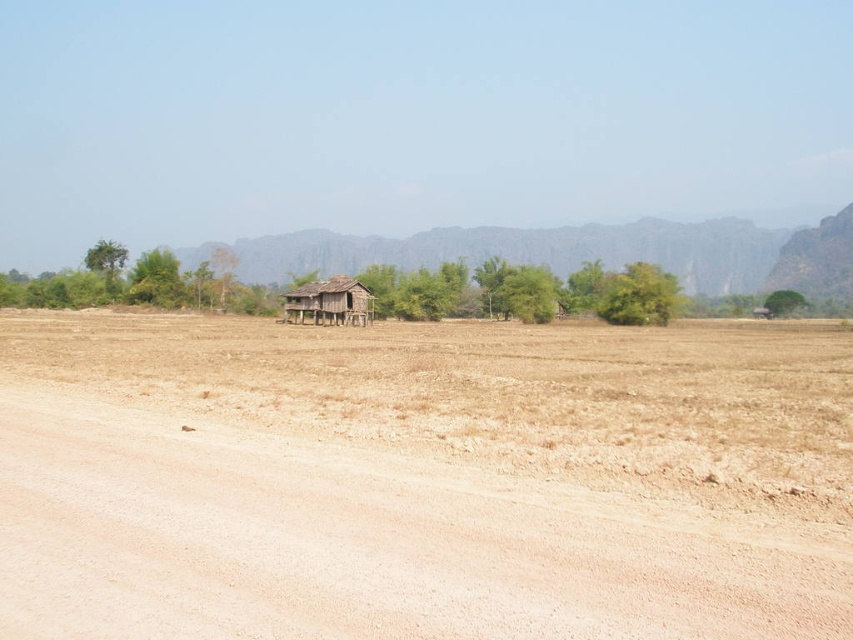
Is point (589, 445) positioned behind point (328, 282)?

That is False.

Which of these two, brown dirt field at center or weathered wood hut at center, stands taller?

weathered wood hut at center

Is point (155, 368) positioned behind point (352, 301)?

No, (155, 368) is closer to viewer.

Find the location of `brown dirt field at center`. brown dirt field at center is located at coordinates (422, 480).

Is rugged stone mountain at center thinner than weathered wood hut at center?

Incorrect, rugged stone mountain at center's width is not less than weathered wood hut at center's.

Describe the element at coordinates (578, 252) in the screenshot. I see `rugged stone mountain at center` at that location.

Find the location of `rugged stone mountain at center`. rugged stone mountain at center is located at coordinates (578, 252).

How far apart are brown dirt field at center and rugged stone mountain at center?

100.95 meters

Which of these two, brown dirt field at center or rugged stone mountain at center, stands taller?

rugged stone mountain at center

The image size is (853, 640). Describe the element at coordinates (422, 480) in the screenshot. I see `brown dirt field at center` at that location.

This screenshot has height=640, width=853. In order to click on brown dirt field at center in this screenshot , I will do pos(422,480).